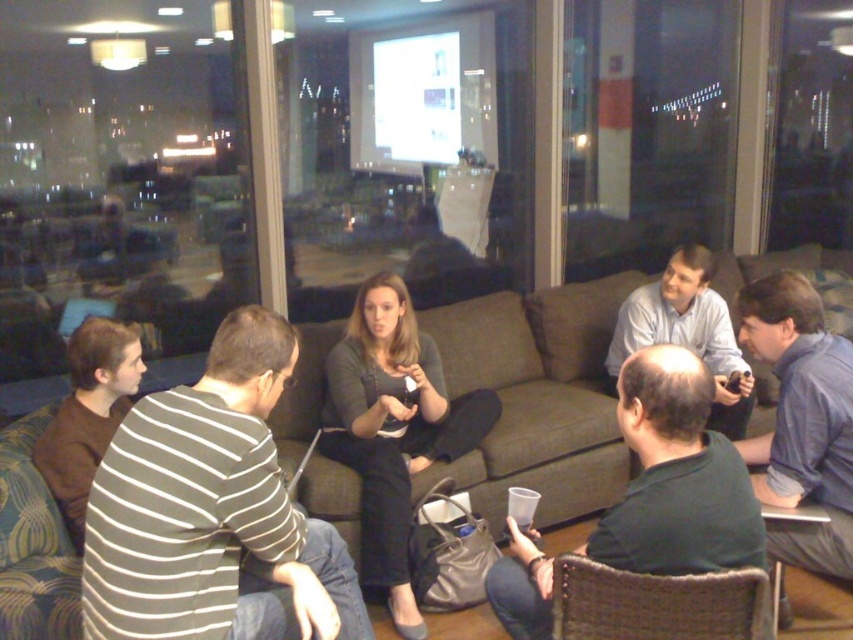
In the scene described, there are two people wearing shirts of different colors. The blue shirt at right and the brown cotton shirt at left. From the perspective of someone facing the group, which shirt is positioned to the right of the other?

The blue shirt at right is positioned to the right of the brown cotton shirt at left.

You are standing in the living room and want to hand a document to the person wearing the dark gray sweater at center and the light blue shirt at center. Which one can you reach without moving closer?

The dark gray sweater at center is closer to the viewer than the light blue shirt at center, so you can reach the person wearing the dark gray sweater at center without moving closer.